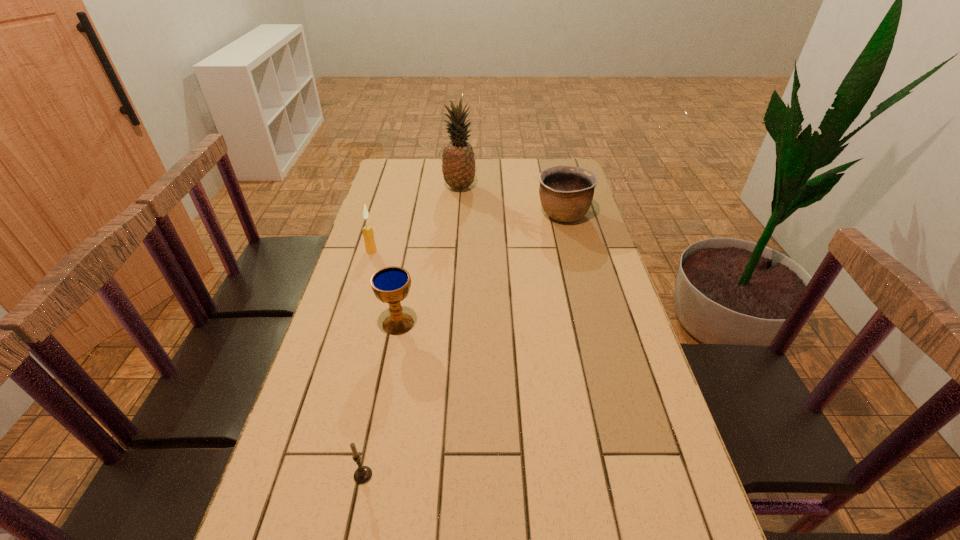
The image size is (960, 540). I want to click on free spot located 0.310m on the back of the third nearest object, so click(387, 199).

Identify the location of vacant space located 0.220m on the back of the chalice. Image resolution: width=960 pixels, height=540 pixels. (410, 261).

This screenshot has width=960, height=540. In order to click on vacant position located 0.400m on the left of the pottery in this screenshot , I will do `click(426, 214)`.

Find the location of a particular element. The image size is (960, 540). vacant space located on the right of the nearest object is located at coordinates (397, 475).

The width and height of the screenshot is (960, 540). In order to click on object at the far edge in this screenshot , I will do `click(458, 164)`.

Find the location of `chalice present at the left edge`. chalice present at the left edge is located at coordinates pyautogui.click(x=391, y=285).

What are the coordinates of `object located at the right edge` in the screenshot? It's located at (566, 192).

In the image, there is a desktop. At what (x,y) coordinates should I click in order to perform the action: click on vacant space at the far edge. Please return your answer as a coordinate pair (x, y). The width and height of the screenshot is (960, 540). Looking at the image, I should click on (490, 183).

Where is `vacant space at the left edge of the desktop`? This screenshot has width=960, height=540. vacant space at the left edge of the desktop is located at coordinates (357, 255).

Identify the location of vacant area at the right edge. pos(604,349).